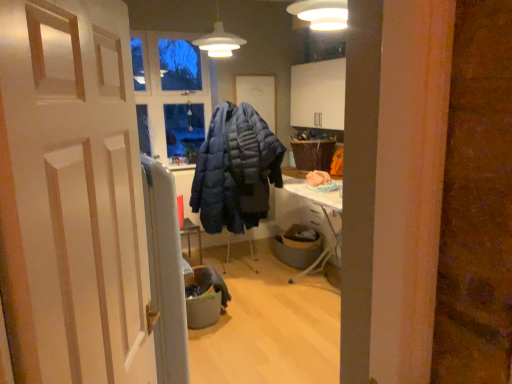
Describe the element at coordinates (313, 153) in the screenshot. I see `woven brown picnic basket at upper right` at that location.

Locate an element on the screen. gray fabric trash bin at center, which appears as the 1th trash bin/can when viewed from the right is located at coordinates (297, 246).

Locate an element on the screen. woven brown picnic basket at upper right is located at coordinates (313, 153).

From the image's perspective, which is above, white wooden door at center or gray fabric trash bin at center, which is the first trash bin/can in front-to-back order?

From the image's view, white wooden door at center is above.

Considering the relative positions of white wooden door at center and gray fabric trash bin at center, which is the first trash bin/can in front-to-back order, in the image provided, is white wooden door at center to the left or to the right of gray fabric trash bin at center, which is the first trash bin/can in front-to-back order,?

From the image, it's evident that white wooden door at center is to the right of gray fabric trash bin at center, which is the first trash bin/can in front-to-back order.

In the scene shown: Do you think white wooden door at center is within gray fabric trash bin at center, arranged as the 2th trash bin/can when viewed from the back, or outside of it?

white wooden door at center is not inside gray fabric trash bin at center, arranged as the 2th trash bin/can when viewed from the back, it's outside.

Is white wooden door at center smaller than gray fabric trash bin at center, arranged as the 2th trash bin/can when viewed from the back?

No, white wooden door at center is not smaller than gray fabric trash bin at center, arranged as the 2th trash bin/can when viewed from the back.

Is matte blue puffer jacket at center located within gray fabric trash bin at center, marked as the second trash bin/can in a front-to-back arrangement?

No, matte blue puffer jacket at center is not inside gray fabric trash bin at center, marked as the second trash bin/can in a front-to-back arrangement.

Consider the image. Is gray fabric trash bin at center, which appears as the 1th trash bin/can when viewed from the right, looking in the opposite direction of matte blue puffer jacket at center?

No, gray fabric trash bin at center, which appears as the 1th trash bin/can when viewed from the right,'s orientation is not away from matte blue puffer jacket at center.

Are gray fabric trash bin at center, which appears as the 1th trash bin/can when viewed from the right, and matte blue puffer jacket at center beside each other?

gray fabric trash bin at center, which appears as the 1th trash bin/can when viewed from the right, is not next to matte blue puffer jacket at center, and they're not touching.

From the image's perspective, is gray fabric trash bin at center, placed as the 2th trash bin/can when sorted from left to right, located above or below matte blue puffer jacket at center?

gray fabric trash bin at center, placed as the 2th trash bin/can when sorted from left to right, is situated lower than matte blue puffer jacket at center in the image.

Is woven brown picnic basket at upper right thinner than matte white pendant light at upper center?

In fact, woven brown picnic basket at upper right might be wider than matte white pendant light at upper center.

Which is closer to the camera, (x=322, y=145) or (x=210, y=51)?

Point (x=322, y=145) appears to be farther away from the viewer than point (x=210, y=51).

From the image's perspective, is woven brown picnic basket at upper right on top of matte white pendant light at upper center?

Actually, woven brown picnic basket at upper right appears below matte white pendant light at upper center in the image.

Can you confirm if woven brown picnic basket at upper right is positioned to the left of matte white pendant light at upper center?

Incorrect, woven brown picnic basket at upper right is not on the left side of matte white pendant light at upper center.

Considering the relative sizes of matte blue puffer jacket at center and white wooden door at center in the image provided, is matte blue puffer jacket at center shorter than white wooden door at center?

Incorrect, the height of matte blue puffer jacket at center does not fall short of that of white wooden door at center.

Is matte blue puffer jacket at center facing away from white wooden door at center?

matte blue puffer jacket at center does not have its back to white wooden door at center.

What's the angular difference between matte blue puffer jacket at center and white wooden door at center's facing directions?

There is a 54.7-degree angle between the facing directions of matte blue puffer jacket at center and white wooden door at center.

In the image, is woven brown picnic basket at upper right on the left side or the right side of gray fabric trash bin at center, which is the 1th trash bin/can from back to front?

Clearly, woven brown picnic basket at upper right is on the right of gray fabric trash bin at center, which is the 1th trash bin/can from back to front, in the image.

What are the coordinates of `picnic basket that appears behind the gray fabric trash bin at center, which is the 1th trash bin/can from back to front` in the screenshot? It's located at (313, 153).

Who is bigger, woven brown picnic basket at upper right or gray fabric trash bin at center, which is the 1th trash bin/can from back to front?

woven brown picnic basket at upper right is bigger.

From a real-world perspective, which is physically above, woven brown picnic basket at upper right or gray fabric trash bin at center, which is the 1th trash bin/can from back to front?

woven brown picnic basket at upper right, from a real-world perspective.

Does matte white pendant light at upper center touch gray fabric trash bin at center, arranged as the 2th trash bin/can when viewed from the back?

matte white pendant light at upper center and gray fabric trash bin at center, arranged as the 2th trash bin/can when viewed from the back, are clearly separated.

Locate an element on the screen. lamp above the gray fabric trash bin at center, arranged as the 2th trash bin/can when viewed from the back (from the image's perspective) is located at coordinates (219, 40).

Considering the relative positions of matte white pendant light at upper center and gray fabric trash bin at center, the first trash bin/can in the left-to-right sequence, in the image provided, is matte white pendant light at upper center to the left of gray fabric trash bin at center, the first trash bin/can in the left-to-right sequence, from the viewer's perspective?

Incorrect, matte white pendant light at upper center is not on the left side of gray fabric trash bin at center, the first trash bin/can in the left-to-right sequence.

Considering the positions of objects matte white pendant light at upper center and gray fabric trash bin at center, the first trash bin/can in the left-to-right sequence, in the image provided, who is behind, matte white pendant light at upper center or gray fabric trash bin at center, the first trash bin/can in the left-to-right sequence,?

matte white pendant light at upper center is further from the camera.

From a real-world perspective, between matte blue puffer jacket at center and gray fabric trash bin at center, which appears as the 1th trash bin/can when viewed from the right, who is vertically higher?

matte blue puffer jacket at center is physically above.

Is point (256, 217) farther from viewer compared to point (305, 264)?

No, (256, 217) is in front of (305, 264).

Consider the image. From the image's perspective, would you say matte blue puffer jacket at center is positioned over gray fabric trash bin at center, placed as the 2th trash bin/can when sorted from left to right?

Yes, from the image's perspective, matte blue puffer jacket at center is over gray fabric trash bin at center, placed as the 2th trash bin/can when sorted from left to right.

This screenshot has width=512, height=384. Identify the location of door that appears in front of the gray fabric trash bin at center, arranged as the 2th trash bin/can when viewed from the back. (72, 196).

I want to click on trash bin/can that is the 1st object directly below the matte blue puffer jacket at center (from a real-world perspective), so click(297, 246).

Consider the image. Which object lies further to the anchor point gray fabric trash bin at center, which is the 1th trash bin/can from back to front, gray fabric trash bin at center, which is the first trash bin/can in front-to-back order, or white wooden door at center?

Among the two, white wooden door at center is located further to gray fabric trash bin at center, which is the 1th trash bin/can from back to front.

Considering their positions, is woven brown picnic basket at upper right positioned closer to matte white pendant light at upper center than gray fabric trash bin at center, arranged as the 2th trash bin/can when viewed from the back?

Based on the image, woven brown picnic basket at upper right appears to be nearer to matte white pendant light at upper center.

Looking at this image, based on their spatial positions, is matte white pendant light at upper center or gray fabric trash bin at center, arranged as the 2th trash bin/can when viewed from the back, closer to gray fabric trash bin at center, marked as the second trash bin/can in a front-to-back arrangement?

gray fabric trash bin at center, arranged as the 2th trash bin/can when viewed from the back, is positioned closer to the anchor gray fabric trash bin at center, marked as the second trash bin/can in a front-to-back arrangement.

Estimate the real-world distances between objects in this image. Which object is closer to woven brown picnic basket at upper right, gray fabric trash bin at center, the first trash bin/can in the left-to-right sequence, or gray fabric trash bin at center, which appears as the 1th trash bin/can when viewed from the right?

The object closer to woven brown picnic basket at upper right is gray fabric trash bin at center, which appears as the 1th trash bin/can when viewed from the right.

Considering their positions, is gray fabric trash bin at center, which is the first trash bin/can in front-to-back order, positioned further to white wooden door at center than gray fabric trash bin at center, placed as the 2th trash bin/can when sorted from left to right?

gray fabric trash bin at center, placed as the 2th trash bin/can when sorted from left to right.

Which object lies further to the anchor point gray fabric trash bin at center, placed as the 2th trash bin/can when sorted from right to left, woven brown picnic basket at upper right or gray fabric trash bin at center, placed as the 2th trash bin/can when sorted from left to right?

Among the two, woven brown picnic basket at upper right is located further to gray fabric trash bin at center, placed as the 2th trash bin/can when sorted from right to left.

Looking at the image, which one is located further to gray fabric trash bin at center, placed as the 2th trash bin/can when sorted from right to left, matte blue puffer jacket at center or white wooden door at center?

white wooden door at center.

Considering their positions, is gray fabric trash bin at center, marked as the second trash bin/can in a front-to-back arrangement, positioned closer to white wooden door at center than matte blue puffer jacket at center?

matte blue puffer jacket at center is positioned closer to the anchor white wooden door at center.

Identify the location of picnic basket between matte white pendant light at upper center and gray fabric trash bin at center, placed as the 2th trash bin/can when sorted from left to right, from top to bottom. Image resolution: width=512 pixels, height=384 pixels. (313, 153).

Identify the location of picnic basket between matte white pendant light at upper center and gray fabric trash bin at center, which is the first trash bin/can in front-to-back order, in the up-down direction. This screenshot has height=384, width=512. (313, 153).

The image size is (512, 384). Identify the location of jacket located between gray fabric trash bin at center, the first trash bin/can in the left-to-right sequence, and gray fabric trash bin at center, placed as the 2th trash bin/can when sorted from left to right, in the depth direction. (236, 170).

The width and height of the screenshot is (512, 384). Identify the location of trash bin/can between gray fabric trash bin at center, placed as the 2th trash bin/can when sorted from right to left, and woven brown picnic basket at upper right in the front-back direction. (297, 246).